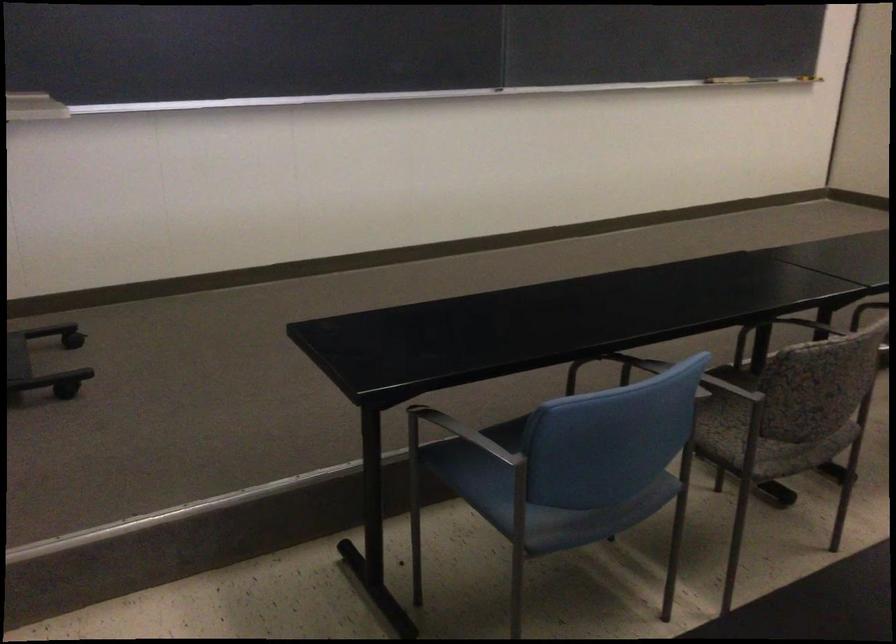
Where would you grasp the chalkboard eraser? Please return your answer as a coordinate pair (x, y).

(33, 107)